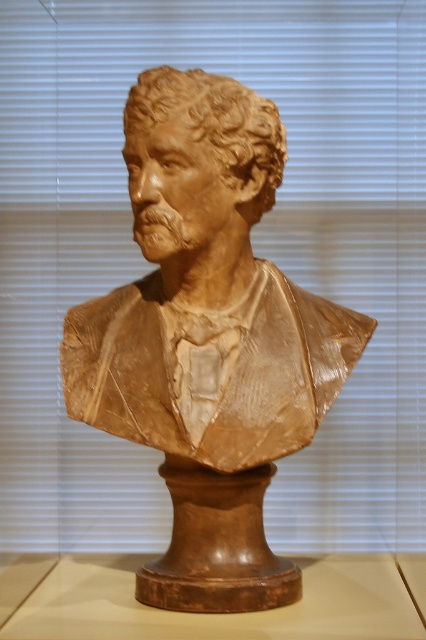
Does matte brown bust at center have a smaller size compared to brown clay bust at center?

Actually, matte brown bust at center might be larger than brown clay bust at center.

Which is in front, point (215, 292) or point (273, 154)?

Point (273, 154) is more forward.

Find the location of a particular element. This screenshot has width=426, height=640. matte brown bust at center is located at coordinates (207, 339).

Locate an element on the screen. Image resolution: width=426 pixels, height=640 pixels. matte brown bust at center is located at coordinates (207, 339).